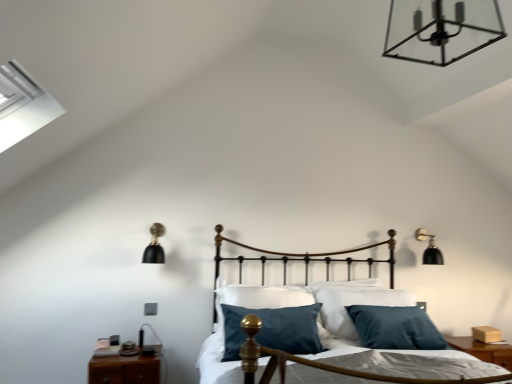
In order to click on vacant space situated above brown wood nightstand at lower left, positioned as the 2th nightstand in back-to-front order (from a real-world perspective) in this screenshot , I will do `click(129, 349)`.